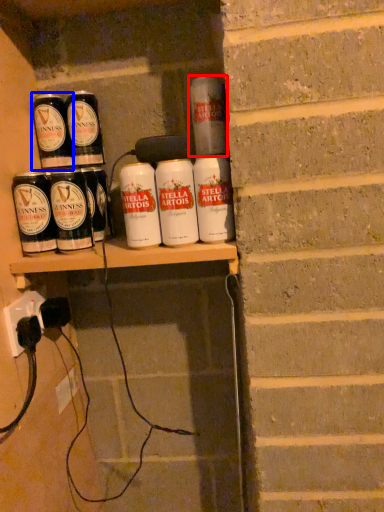
Question: Which of the following is the closest to the observer, tin can (highlighted by a red box) or tin can (highlighted by a blue box)?

Choices:
 (A) tin can
 (B) tin can

Answer: (A)